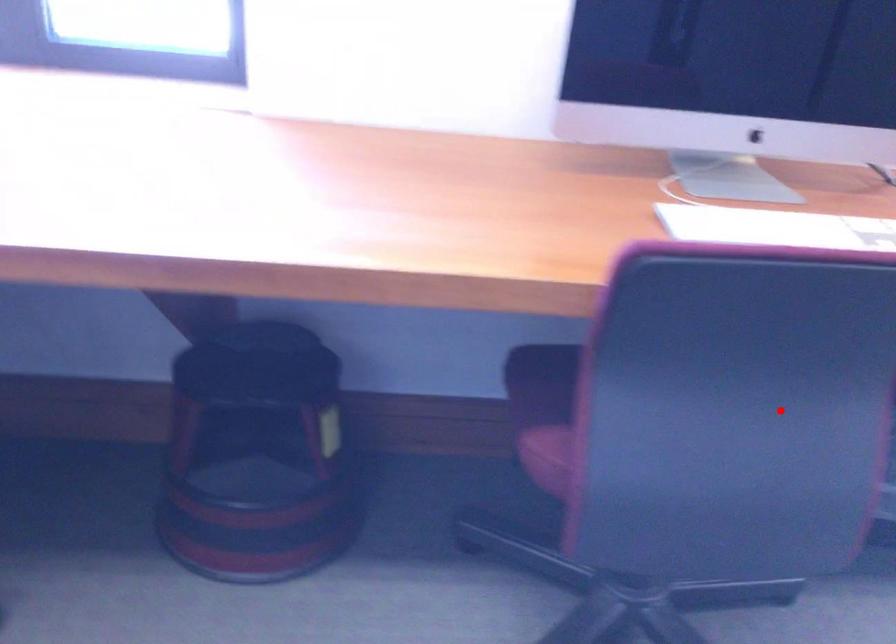
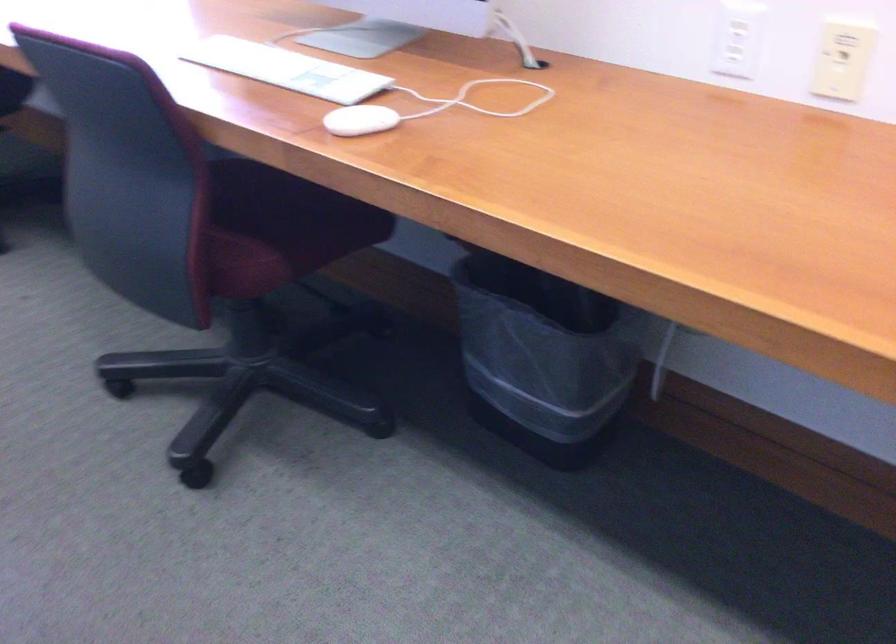
Where in the second image is the point corresponding to the highlighted location from the first image?

(273, 228)